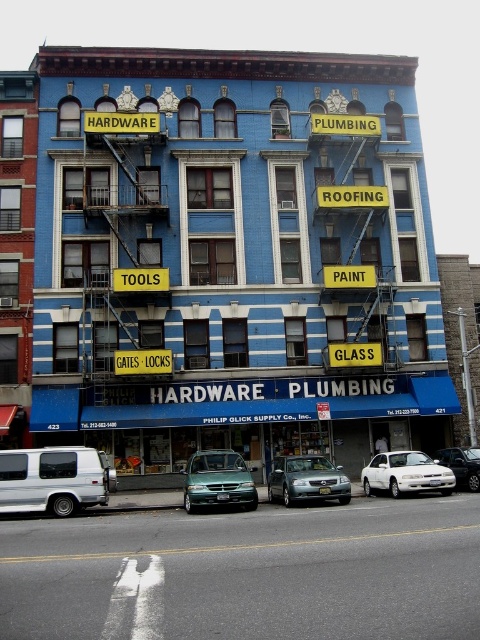
Question: Among these points, which one is farthest from the camera?

Choices:
 (A) (327, 208)
 (B) (454, 467)
 (C) (393, 456)

Answer: (A)

Question: Which object is positioned closest to the blue brick building at center?

Choices:
 (A) white glossy sedan at center
 (B) green matte car at center
 (C) green matte van at center

Answer: (C)

Question: Is metal fire escape at left to the left of white glossy sedan at center from the viewer's perspective?

Choices:
 (A) yes
 (B) no

Answer: (A)

Question: Does white glossy sedan at center come behind silver metallic sedan at center?

Choices:
 (A) yes
 (B) no

Answer: (B)

Question: Considering the real-world distances, which object is farthest from the green matte car at center?

Choices:
 (A) white matte van at lower left
 (B) metallic silver sedan at center
 (C) metal fire escape at left

Answer: (C)

Question: Where is white matte van at lower left located in relation to green matte car at center in the image?

Choices:
 (A) left
 (B) right

Answer: (A)